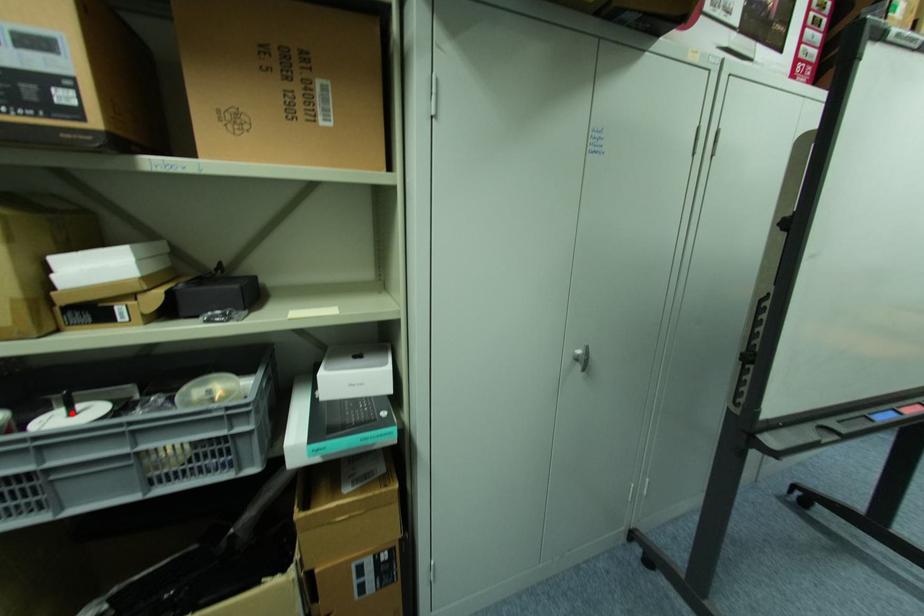
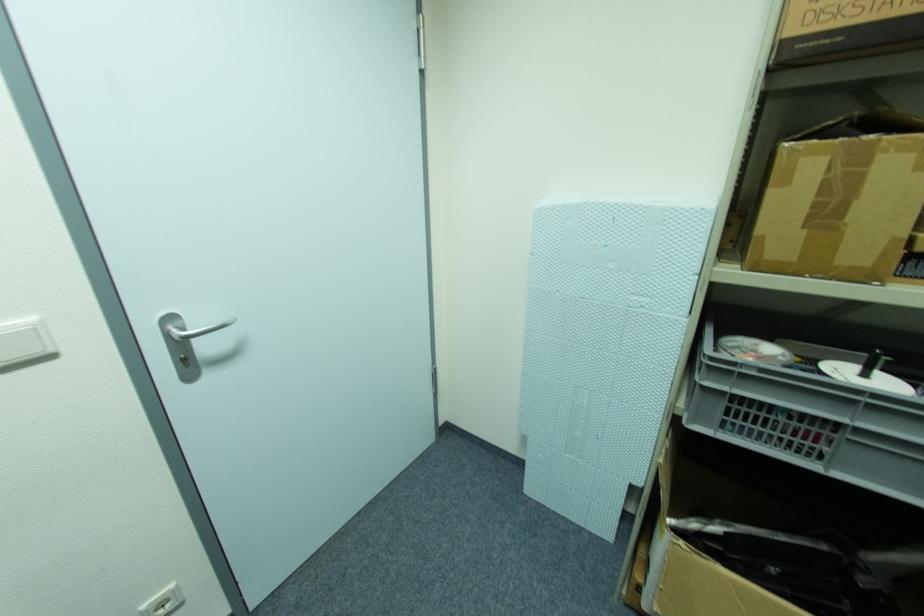
Find the pixel in the second image that matches the highlighted location in the first image.

(867, 376)